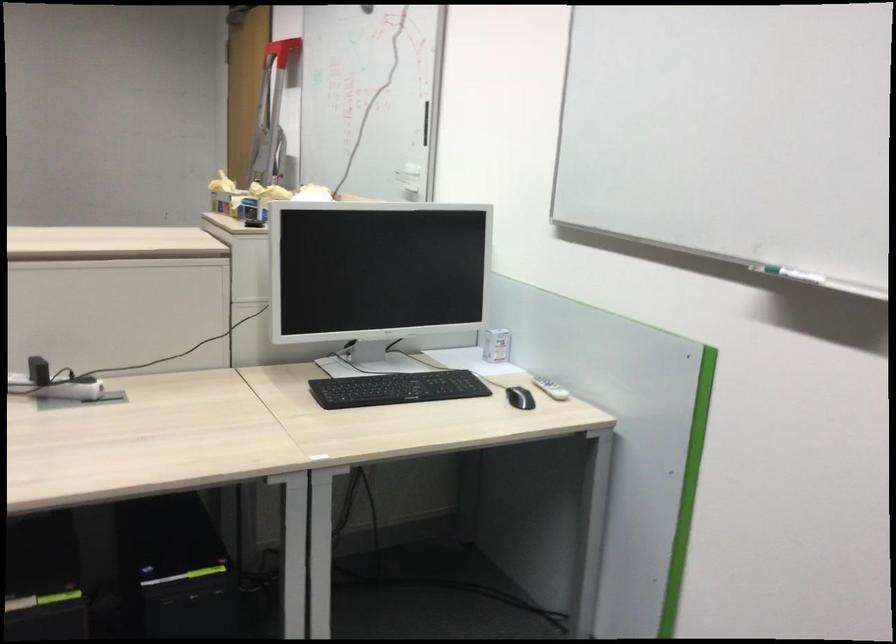
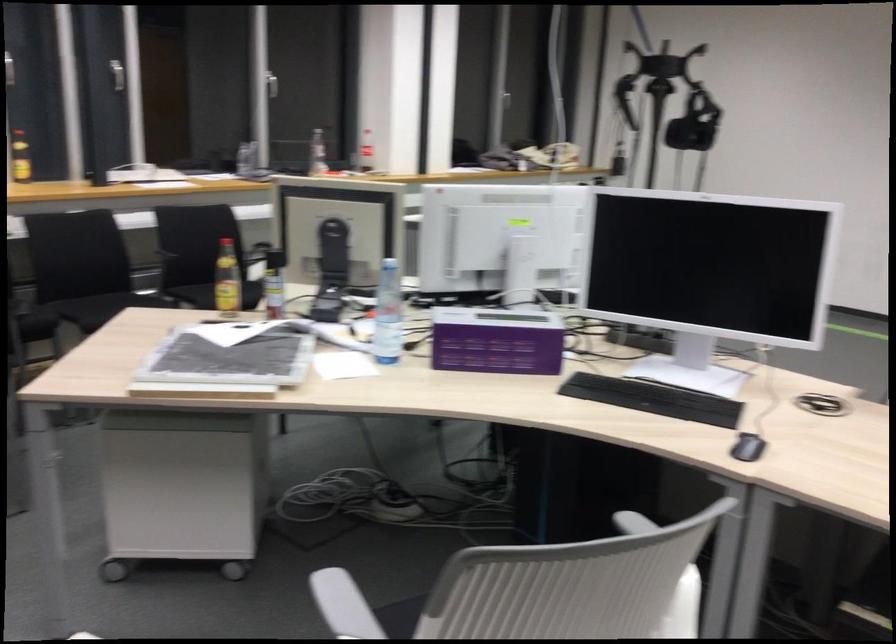
Question: The first image is from the beginning of the video and the second image is from the end. How did the camera likely rotate when shooting the video?

Choices:
 (A) Left
 (B) Right
 (C) Up
 (D) Down

Answer: (A)